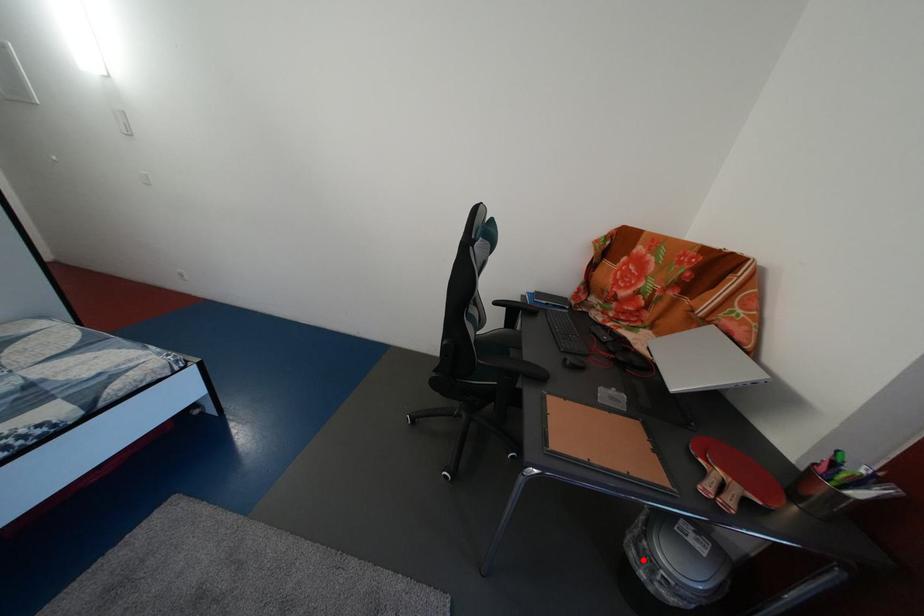
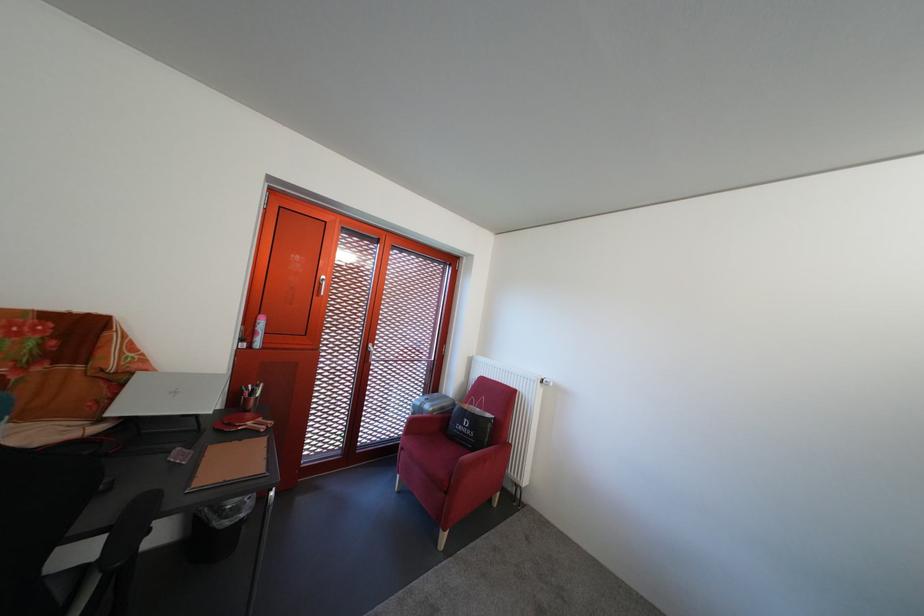
The point at the highlighted location is marked in the first image. Where is the corresponding point in the second image?

(237, 530)